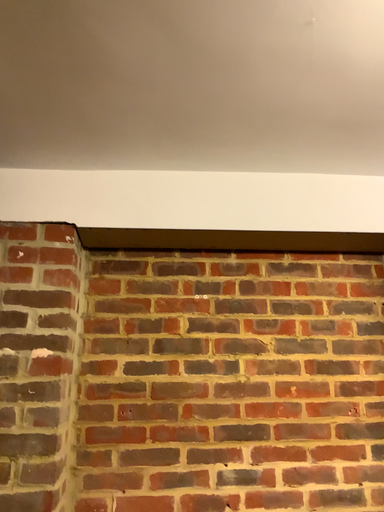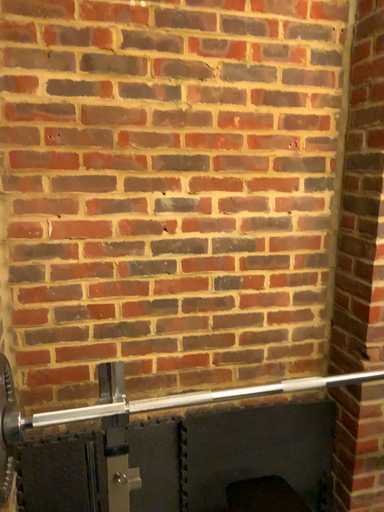
Question: How did the camera likely rotate when shooting the video?

Choices:
 (A) rotated right
 (B) rotated left

Answer: (A)